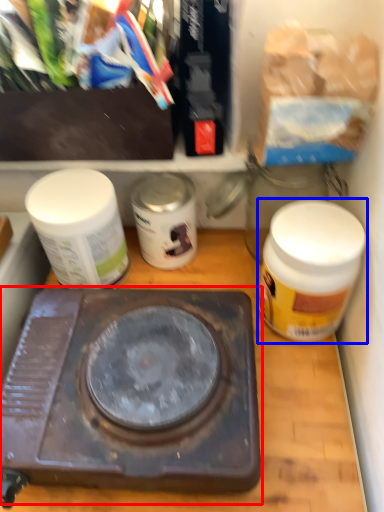
Question: Which object is closer to the camera taking this photo, stove (highlighted by a red box) or bottle (highlighted by a blue box)?

Choices:
 (A) stove
 (B) bottle

Answer: (A)